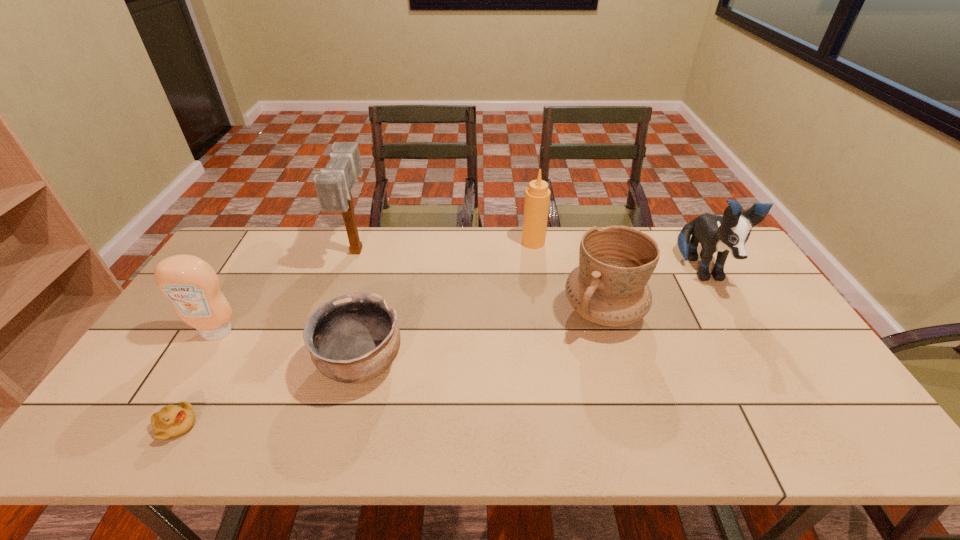
You are a GUI agent. You are given a task and a screenshot of the screen. Output one action in this format:
    pyautogui.click(x=<x>, y=<y>)
    Task: Click on the mallet
    This screenshot has width=960, height=540.
    Given the screenshot: What is the action you would take?
    coord(333,186)

Locate an element on the screen. the rightmost object is located at coordinates (729, 233).

The image size is (960, 540). I want to click on the right condiment, so click(537, 196).

Identify the location of the fifth object from left to right. This screenshot has height=540, width=960. pos(537,196).

Locate an element on the screen. This screenshot has width=960, height=540. the left condiment is located at coordinates (190, 283).

This screenshot has height=540, width=960. Identify the location of the right pottery. (609, 287).

Find the location of `the second object from right to left`. the second object from right to left is located at coordinates (609, 287).

Find the location of a particular element. This screenshot has width=960, height=540. the shorter pottery is located at coordinates (353, 338).

The height and width of the screenshot is (540, 960). What are the coordinates of `the second shortest object` in the screenshot? It's located at (353, 338).

Locate an element on the screen. the shortest object is located at coordinates (171, 421).